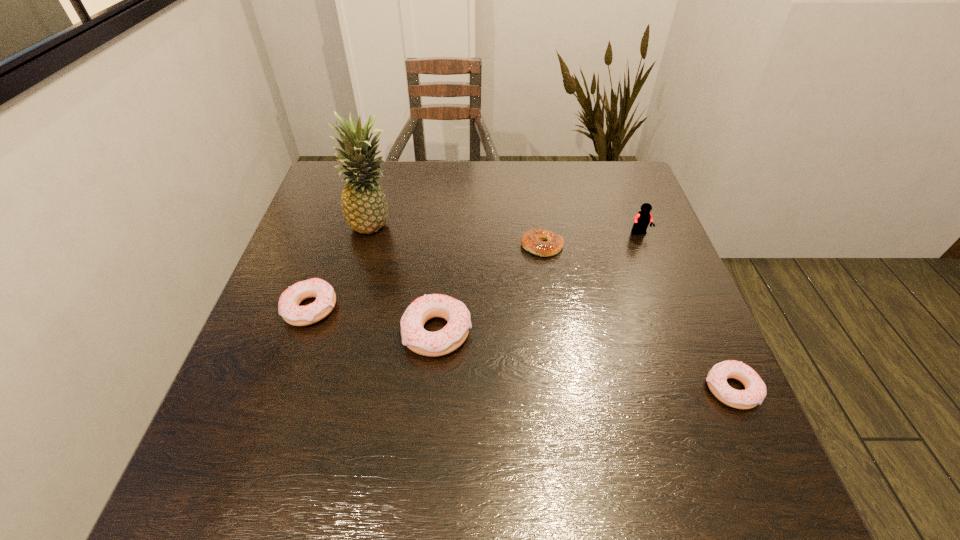
This screenshot has height=540, width=960. I want to click on the leftmost doughnut, so coord(288,307).

The image size is (960, 540). Find the location of `the second tallest doughnut`. the second tallest doughnut is located at coordinates (288, 307).

Image resolution: width=960 pixels, height=540 pixels. I want to click on the tallest doughnut, so click(414, 336).

Find the location of a particular element. the second doughnut from left to right is located at coordinates (414, 336).

Where is `the rightmost doughnut`? The width and height of the screenshot is (960, 540). the rightmost doughnut is located at coordinates (755, 389).

Locate an element on the screen. The width and height of the screenshot is (960, 540). the fifth tallest object is located at coordinates (755, 389).

Locate an element on the screen. This screenshot has width=960, height=540. pineapple is located at coordinates (364, 206).

The width and height of the screenshot is (960, 540). In order to click on the shortest object in this screenshot , I will do `click(532, 240)`.

Locate an element on the screen. bagel is located at coordinates (532, 240).

Locate an element on the screen. Image resolution: width=960 pixels, height=540 pixels. Lego is located at coordinates (641, 221).